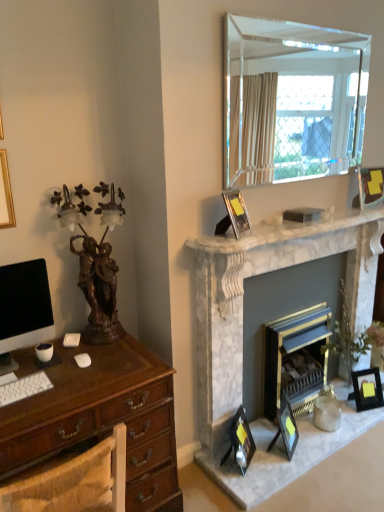
Find the location of a particular element. This screenshot has width=384, height=512. free point below clear glass mirror at upper right (from a real-world perspective) is located at coordinates (292, 218).